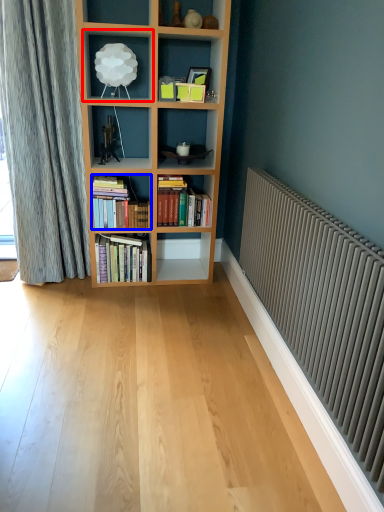
Question: Which object is further to the camera taking this photo, shelf (highlighted by a red box) or book (highlighted by a blue box)?

Choices:
 (A) shelf
 (B) book

Answer: (B)